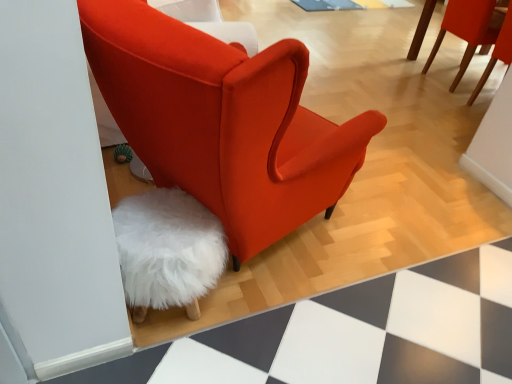
Question: Is velvet orange chair at center, which ranks as the second chair in top-to-bottom order, in front of matte red chair at upper right, which is counted as the second chair, starting from the bottom?

Choices:
 (A) no
 (B) yes

Answer: (B)

Question: Is velvet orange chair at center, which ranks as the second chair in top-to-bottom order, not near matte red chair at upper right, the first chair in the top-to-bottom sequence?

Choices:
 (A) yes
 (B) no

Answer: (A)

Question: Is velvet orange chair at center, which appears as the first chair when viewed from the left, thinner than matte red chair at upper right, arranged as the first chair when viewed from the right?

Choices:
 (A) no
 (B) yes

Answer: (A)

Question: Does velvet orange chair at center, marked as the 2th chair in a right-to-left arrangement, have a greater height compared to matte red chair at upper right, the 1th chair in the back-to-front sequence?

Choices:
 (A) yes
 (B) no

Answer: (A)

Question: From the image's perspective, is velvet orange chair at center, which ranks as the second chair in top-to-bottom order, on top of matte red chair at upper right, the 1th chair in the back-to-front sequence?

Choices:
 (A) no
 (B) yes

Answer: (A)

Question: From a real-world perspective, relative to velvet orange chair at center, arranged as the 1th chair when viewed from the front, is white fluffy stool at lower left vertically above or below?

Choices:
 (A) below
 (B) above

Answer: (A)

Question: Considering their positions, is white fluffy stool at lower left located in front of or behind velvet orange chair at center, which is the 2th chair from back to front?

Choices:
 (A) behind
 (B) front

Answer: (A)

Question: From the image's perspective, is white fluffy stool at lower left located above or below velvet orange chair at center, marked as the 2th chair in a right-to-left arrangement?

Choices:
 (A) above
 (B) below

Answer: (B)

Question: Considering the positions of white fluffy stool at lower left and velvet orange chair at center, which ranks as the second chair in top-to-bottom order, in the image, is white fluffy stool at lower left wider or thinner than velvet orange chair at center, which ranks as the second chair in top-to-bottom order,?

Choices:
 (A) wide
 (B) thin

Answer: (B)

Question: Do you think matte red chair at upper right, arranged as the second chair when viewed from the left, is within white fluffy stool at lower left, or outside of it?

Choices:
 (A) inside
 (B) outside

Answer: (B)

Question: Based on their sizes in the image, would you say matte red chair at upper right, arranged as the second chair when viewed from the left, is bigger or smaller than white fluffy stool at lower left?

Choices:
 (A) big
 (B) small

Answer: (A)

Question: From a real-world perspective, is matte red chair at upper right, the 1th chair in the back-to-front sequence, above or below white fluffy stool at lower left?

Choices:
 (A) above
 (B) below

Answer: (A)

Question: Considering the relative positions of matte red chair at upper right, the first chair in the top-to-bottom sequence, and white fluffy stool at lower left in the image provided, is matte red chair at upper right, the first chair in the top-to-bottom sequence, to the left or to the right of white fluffy stool at lower left?

Choices:
 (A) left
 (B) right

Answer: (B)

Question: From a real-world perspective, is matte red chair at upper right, which is counted as the second chair, starting from the bottom, physically located above or below velvet orange chair at center, which ranks as the second chair in top-to-bottom order?

Choices:
 (A) below
 (B) above

Answer: (A)

Question: Looking at their shapes, would you say matte red chair at upper right, arranged as the second chair when viewed from the left, is wider or thinner than velvet orange chair at center, which is the 2th chair from back to front?

Choices:
 (A) thin
 (B) wide

Answer: (A)